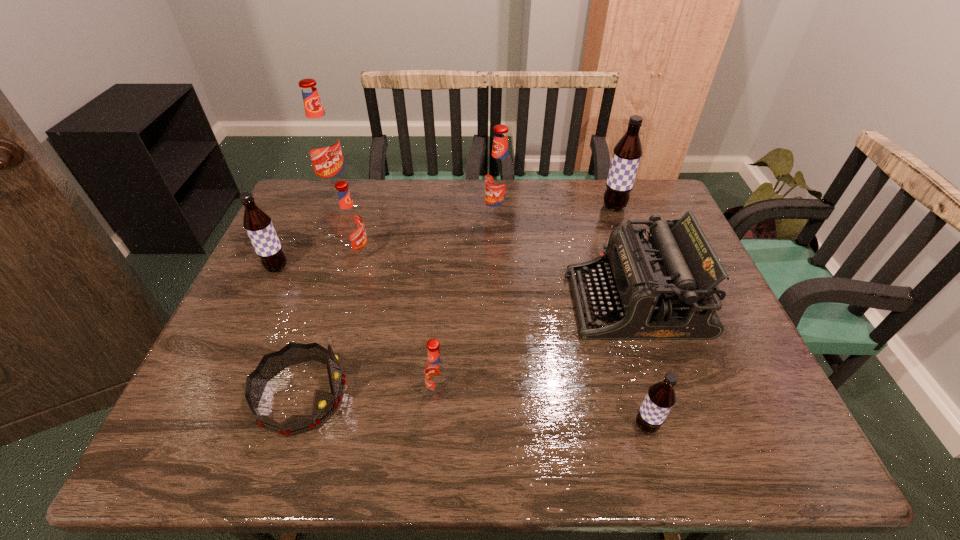
You are a GUI agent. You are given a task and a screenshot of the screen. Output one action in this format:
    pyautogui.click(x=<x>, y=<y>)
    Task: Click on the empty space that is in between the typewriter and the third farthest red root beer
    
    Given the screenshot: What is the action you would take?
    pyautogui.click(x=497, y=279)

The height and width of the screenshot is (540, 960). I want to click on object that ranks as the third closest to the second farthest brown root beer, so click(x=323, y=144).

Image resolution: width=960 pixels, height=540 pixels. In order to click on the eighth closest object to the leftmost brown root beer in this screenshot , I will do `click(627, 153)`.

Select which root beer is the fourth closest to the sixth object from left to right. Please provide its 2D coordinates. Your answer should be formatted as a tuple, i.e. [(x, y)], where the tuple contains the x and y coordinates of a point satisfying the conditions above.

[(436, 372)]

Locate which root beer is the fourth closest to the smallest brown root beer. Please provide its 2D coordinates. Your answer should be formatted as a tuple, i.e. [(x, y)], where the tuple contains the x and y coordinates of a point satisfying the conditions above.

[(350, 222)]

Choose which red root beer is the third nearest neighbor to the shortest object. Please provide its 2D coordinates. Your answer should be formatted as a tuple, i.e. [(x, y)], where the tuple contains the x and y coordinates of a point satisfying the conditions above.

[(499, 174)]

Select which red root beer is the third closest to the second farthest brown root beer. Please provide its 2D coordinates. Your answer should be formatted as a tuple, i.e. [(x, y)], where the tuple contains the x and y coordinates of a point satisfying the conditions above.

[(436, 372)]

I want to click on brown root beer that is the second closest to the shortest object, so click(661, 396).

Find the location of `the closest brown root beer relative to the fifth root beer from left to right`. the closest brown root beer relative to the fifth root beer from left to right is located at coordinates (627, 153).

This screenshot has width=960, height=540. I want to click on free space that satisfies the following two spatial constraints: 1. at the front of the smallest brown root beer with jewels; 2. on the right side of the tiara, so click(x=292, y=426).